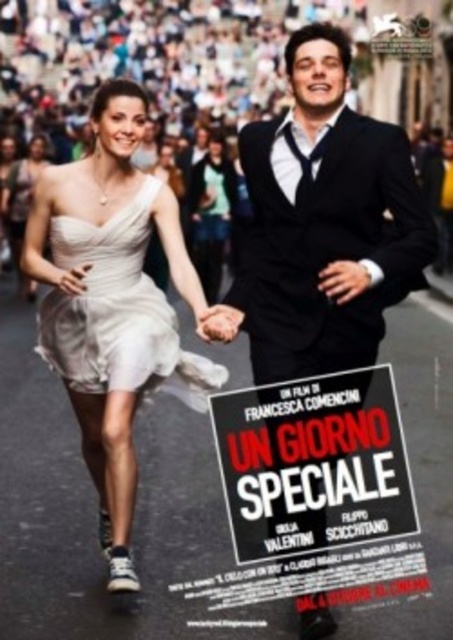
Is shiny black suit at center positioned at the back of matte white text at center?

No, it is in front of matte white text at center.

The height and width of the screenshot is (640, 453). I want to click on shiny black suit at center, so click(x=324, y=221).

Is matte white text at center behind satin white dress at center?

No, it is in front of satin white dress at center.

Does matte white text at center appear under satin white dress at center?

Correct, matte white text at center is located below satin white dress at center.

Locate an element on the screen. Image resolution: width=453 pixels, height=640 pixels. matte white text at center is located at coordinates (313, 484).

Between shiny black suit at center and smooth skin hand at center, which one appears on the left side from the viewer's perspective?

From the viewer's perspective, smooth skin hand at center appears more on the left side.

Does shiny black suit at center have a smaller size compared to smooth skin hand at center?

No.

Between point (254, 292) and point (231, 312), which one is positioned in front?

Point (231, 312) is more forward.

You are a GUI agent. You are given a task and a screenshot of the screen. Output one action in this format:
    pyautogui.click(x=<x>, y=<y>)
    Task: Click on the shiny black suit at center
    
    Given the screenshot: What is the action you would take?
    pyautogui.click(x=324, y=221)